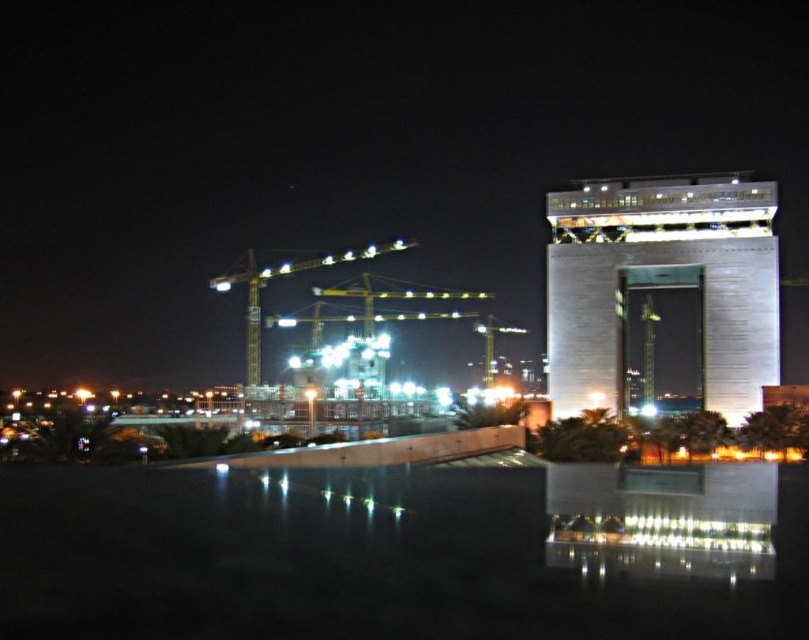
You are an architect reviewing the construction site layout. You need to determine the spatial relationship between the matte concrete construction site at center and the sleek gray building at upper right. Which object is positioned higher in the image?

The sleek gray building at upper right is positioned higher than the matte concrete construction site at center.

You are an architect reviewing the construction site layout. You notice the sleek gray building at upper right and the yellow metallic crane at center. Based on their positions, which object is located to the east if the crane is facing north?

The sleek gray building at upper right is to the right of the yellow metallic crane at center. Since the crane is facing north, its right side would be east. Therefore, the sleek gray building at upper right is positioned to the east of the yellow metallic crane at center.

You are an architect reviewing this urban scene. You notice the sleek gray building at upper right and the yellow metallic crane at center. Which object has a narrower width when viewed from above?

The sleek gray building at upper right is thinner than the yellow metallic crane at center, so the sleek gray building at upper right has a narrower width when viewed from above.